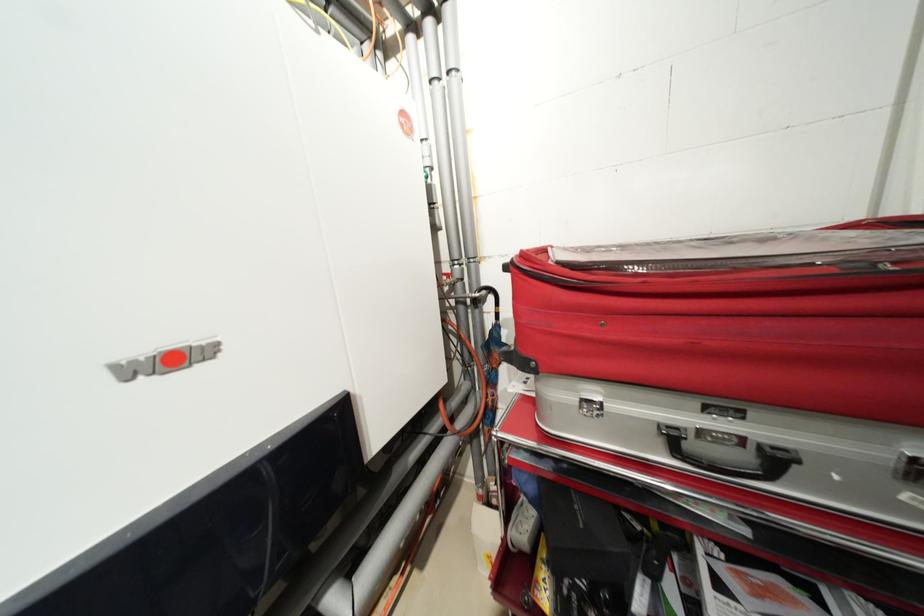
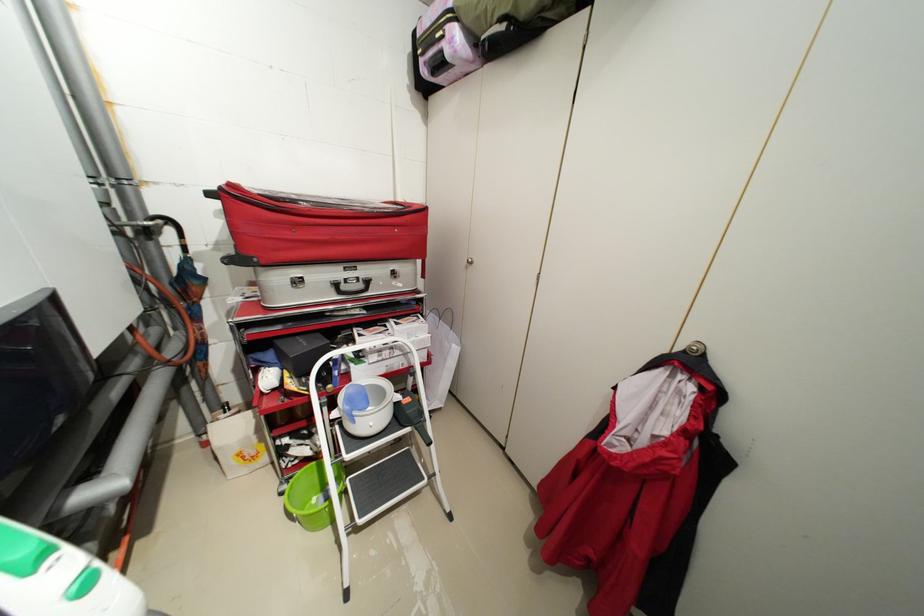
Question: The first image is from the beginning of the video and the second image is from the end. How did the camera likely rotate when shooting the video?

Choices:
 (A) Left
 (B) Right
 (C) Up
 (D) Down

Answer: (B)